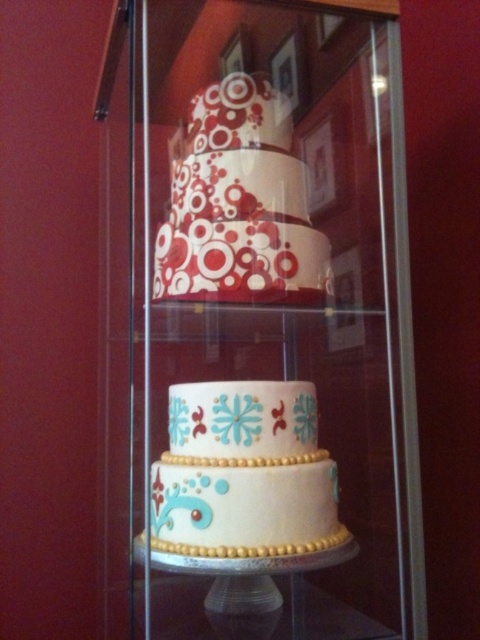
Question: Which object is the farthest from the transparent glass door at center?

Choices:
 (A) matte red and white cake at center
 (B) transparent glass cake stand at center

Answer: (B)

Question: Can you confirm if transparent glass door at center is smaller than white fondant cake at center?

Choices:
 (A) yes
 (B) no

Answer: (B)

Question: Which of the following is the closest to the observer?

Choices:
 (A) transparent glass door at center
 (B) white glossy glass plate at center
 (C) transparent glass cake stand at center
 (D) matte red and white cake at center

Answer: (A)

Question: Can you confirm if matte red and white cake at center is smaller than transparent glass cake stand at center?

Choices:
 (A) yes
 (B) no

Answer: (B)

Question: Does matte red and white cake at center appear on the left side of white glossy glass plate at center?

Choices:
 (A) no
 (B) yes

Answer: (B)

Question: Based on their relative distances, which object is farther from the matte red and white cake at center?

Choices:
 (A) white fondant cake at center
 (B) transparent glass cake stand at center
 (C) white glossy glass plate at center
 (D) transparent glass door at center

Answer: (B)